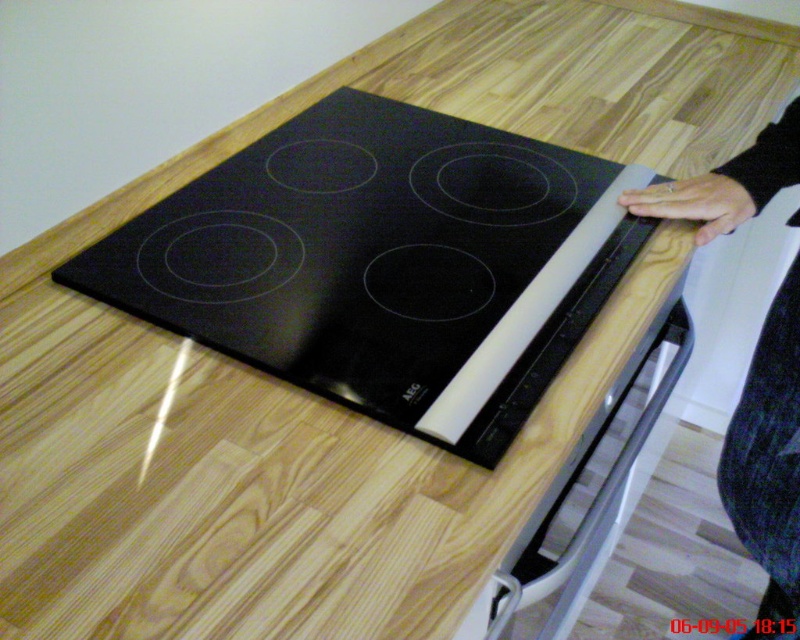
You are a chef preparing to cook and you see the black glass cooktop at center and the black matte hand at upper right in the scene. Which object is taller?

The black matte hand at upper right is taller than the black glass cooktop at center.

You are standing in the kitchen and see the black glass cooktop at center and the black matte hand at upper right. Which object is closer to the right edge of the image?

The black matte hand at upper right is closer to the right edge of the image because the black glass cooktop at center is to its left.